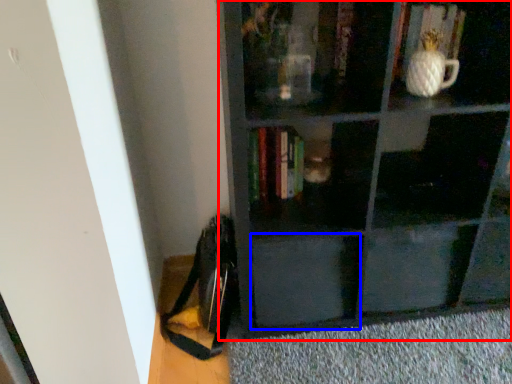
Question: Which point is further to the camera, shelf (highlighted by a red box) or drawer (highlighted by a blue box)?

Choices:
 (A) shelf
 (B) drawer

Answer: (B)